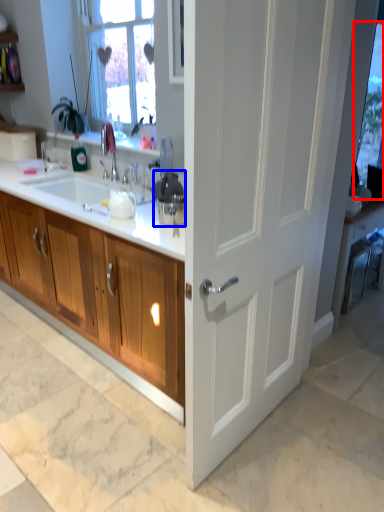
Question: Among these objects, which one is farthest to the camera, window screen (highlighted by a red box) or appliance (highlighted by a blue box)?

Choices:
 (A) window screen
 (B) appliance

Answer: (A)